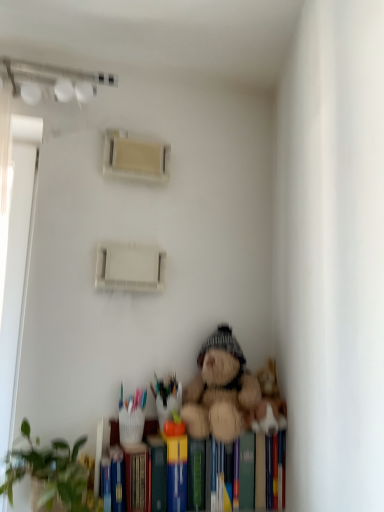
Question: Is fuzzy brown teddy bear at lower center next to green matte plant at lower left and touching it?

Choices:
 (A) yes
 (B) no

Answer: (B)

Question: From a real-world perspective, is fuzzy brown teddy bear at lower center beneath green matte plant at lower left?

Choices:
 (A) yes
 (B) no

Answer: (B)

Question: Considering the relative sizes of fuzzy brown teddy bear at lower center and green matte plant at lower left in the image provided, is fuzzy brown teddy bear at lower center bigger than green matte plant at lower left?

Choices:
 (A) no
 (B) yes

Answer: (A)

Question: Is fuzzy brown teddy bear at lower center further to the viewer compared to green matte plant at lower left?

Choices:
 (A) no
 (B) yes

Answer: (B)

Question: From the image's perspective, is fuzzy brown teddy bear at lower center located above green matte plant at lower left?

Choices:
 (A) yes
 (B) no

Answer: (A)

Question: Considering the relative sizes of fuzzy brown teddy bear at lower center and green matte plant at lower left in the image provided, is fuzzy brown teddy bear at lower center taller than green matte plant at lower left?

Choices:
 (A) no
 (B) yes

Answer: (B)

Question: From the image's perspective, is green matte plant at lower left on top of fuzzy brown teddy bear at lower center?

Choices:
 (A) yes
 (B) no

Answer: (B)

Question: Is green matte plant at lower left to the right of fuzzy brown teddy bear at lower center from the viewer's perspective?

Choices:
 (A) no
 (B) yes

Answer: (A)

Question: From a real-world perspective, is green matte plant at lower left over fuzzy brown teddy bear at lower center?

Choices:
 (A) no
 (B) yes

Answer: (A)

Question: Is green matte plant at lower left far from fuzzy brown teddy bear at lower center?

Choices:
 (A) yes
 (B) no

Answer: (B)

Question: Can you confirm if green matte plant at lower left is smaller than fuzzy brown teddy bear at lower center?

Choices:
 (A) yes
 (B) no

Answer: (B)

Question: Is green matte plant at lower left aimed at fuzzy brown teddy bear at lower center?

Choices:
 (A) no
 (B) yes

Answer: (A)

Question: Can you confirm if fuzzy brown teddy bear at lower center is taller than hardcover book at lower center?

Choices:
 (A) no
 (B) yes

Answer: (B)